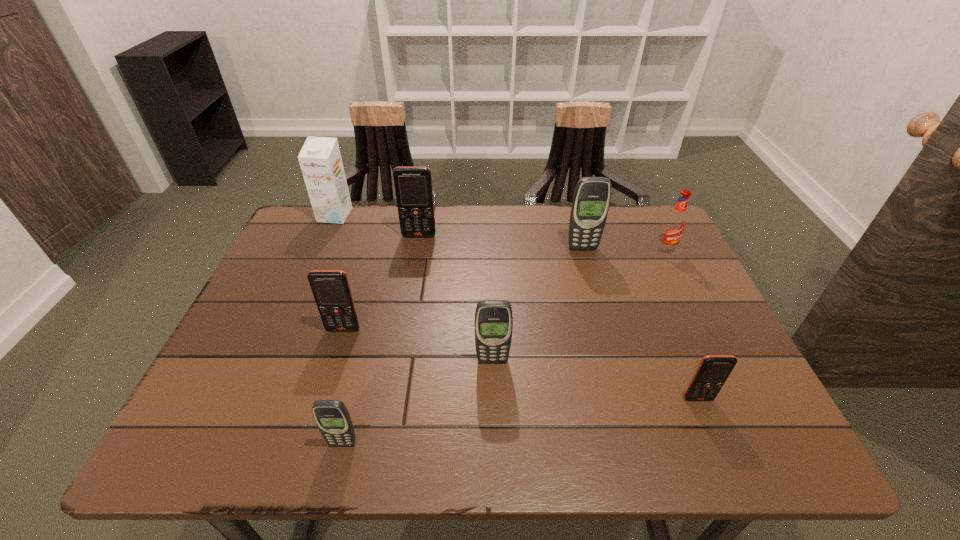
The height and width of the screenshot is (540, 960). Identify the location of gray cellular telephone that stands as the closest to the rightmost cellular telephone. (493, 318).

Identify which gray cellular telephone is located as the third nearest to the smallest orange cellular telephone. Please provide its 2D coordinates. Your answer should be formatted as a tuple, i.e. [(x, y)], where the tuple contains the x and y coordinates of a point satisfying the conditions above.

[(333, 420)]

Locate an element on the screen. free space in the image that satisfies the following two spatial constraints: 1. on the screen of the second farthest object; 2. on the left side of the root beer is located at coordinates (417, 250).